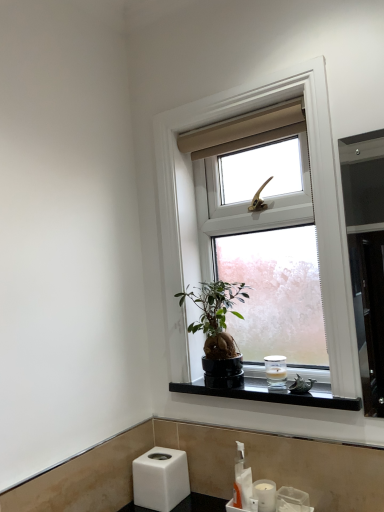
Question: From a real-world perspective, is white plastic soap dispenser at lower center physically below white glossy sink at lower center?

Choices:
 (A) no
 (B) yes

Answer: (A)

Question: Is white plastic soap dispenser at lower center behind white glossy sink at lower center?

Choices:
 (A) no
 (B) yes

Answer: (B)

Question: Is white plastic soap dispenser at lower center thinner than white glossy sink at lower center?

Choices:
 (A) no
 (B) yes

Answer: (B)

Question: Considering the relative positions of white plastic soap dispenser at lower center and white glossy sink at lower center in the image provided, is white plastic soap dispenser at lower center to the right of white glossy sink at lower center from the viewer's perspective?

Choices:
 (A) yes
 (B) no

Answer: (B)

Question: Are white plastic soap dispenser at lower center and white glossy sink at lower center far apart?

Choices:
 (A) no
 (B) yes

Answer: (A)

Question: Is white plastic soap dispenser at lower center located outside white glossy sink at lower center?

Choices:
 (A) yes
 (B) no

Answer: (A)

Question: Are black polished stone at lower center and white plastic soap dispenser at lower center far apart?

Choices:
 (A) yes
 (B) no

Answer: (B)

Question: Is black polished stone at lower center wider than white plastic soap dispenser at lower center?

Choices:
 (A) yes
 (B) no

Answer: (A)

Question: Is black polished stone at lower center further to the viewer compared to white plastic soap dispenser at lower center?

Choices:
 (A) no
 (B) yes

Answer: (A)

Question: Considering the relative sizes of black polished stone at lower center and white plastic soap dispenser at lower center in the image provided, is black polished stone at lower center smaller than white plastic soap dispenser at lower center?

Choices:
 (A) no
 (B) yes

Answer: (A)

Question: Does black polished stone at lower center have a lesser height compared to white plastic soap dispenser at lower center?

Choices:
 (A) yes
 (B) no

Answer: (A)

Question: Can you confirm if black polished stone at lower center is bigger than white plastic soap dispenser at lower center?

Choices:
 (A) yes
 (B) no

Answer: (A)

Question: Is black polished stone at lower center positioned beyond the bounds of white frosted glass candle at lower right, acting as the second toiletry starting from the front?

Choices:
 (A) no
 (B) yes

Answer: (B)